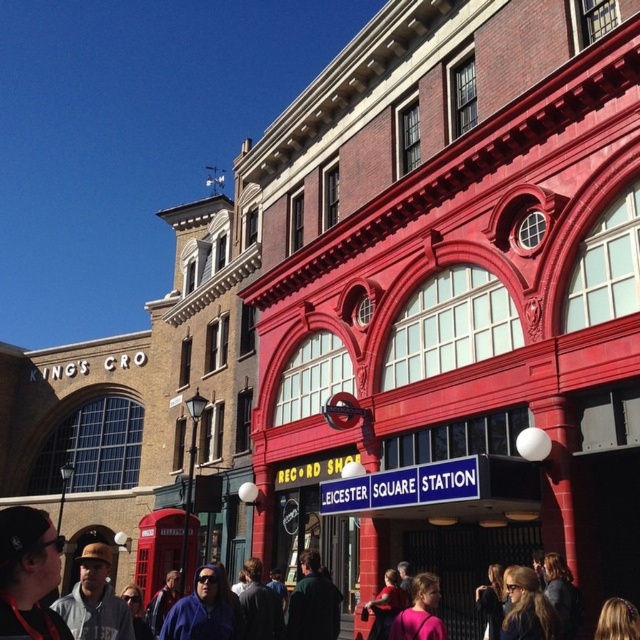
You are a pedestrian standing in front of the two buildings. You notice a matte black cap at lower left and a gray hoodie at lower left. Which item is positioned higher on your view?

The matte black cap at lower left is located above the gray hoodie at lower left, so it is positioned higher in your view.

You are a photographer standing in the middle of the scene. You notice a dark clothing crowd at lower center and a matte black cap at lower left. Which object is positioned higher from the ground?

The matte black cap at lower left is positioned higher than the dark clothing crowd at lower center because the dark clothing crowd at lower center is below the matte black cap at lower left.

You are a photographer planning to take a wide shot of the scene. You notice the dark clothing crowd at lower center and the matte black cap at lower left. Which object should you focus on to ensure both are in frame without zooming in or out?

You should focus on the dark clothing crowd at lower center because it is wider than the matte black cap at lower left, ensuring both fit within the frame when centered on the larger object.